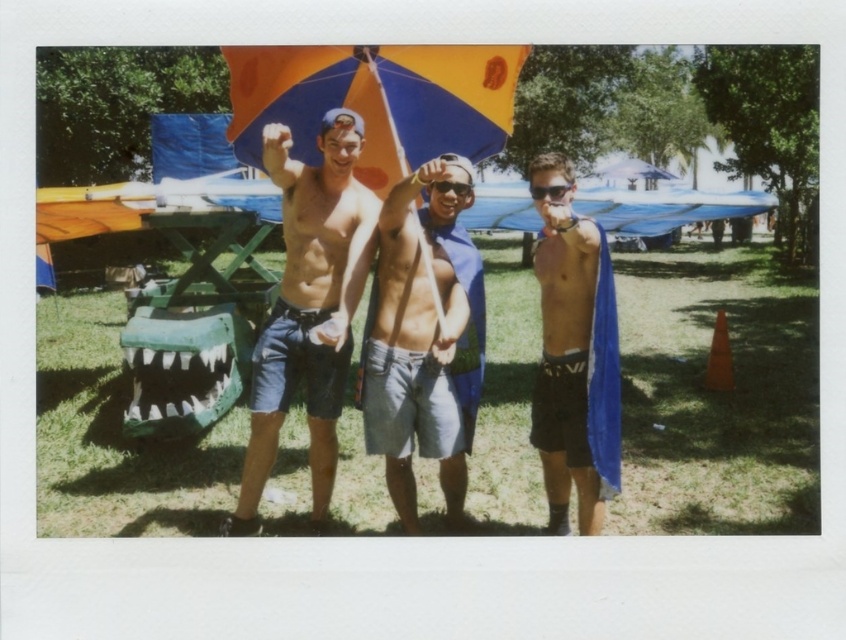
Which is behind, point (391, 356) or point (463, 182)?

Point (391, 356)

The width and height of the screenshot is (846, 640). Identify the location of gray cotton shorts at center. (423, 342).

Identify the location of gray cotton shorts at center. (423, 342).

Image resolution: width=846 pixels, height=640 pixels. I want to click on gray cotton shorts at center, so click(x=423, y=342).

Who is more distant from viewer, [283,45] or [585,406]?

The point [283,45] is behind.

This screenshot has width=846, height=640. I want to click on orange and blue umbrella at center, so click(x=377, y=100).

Consider the image. Who is taller, gray cotton shorts at center or black plastic goggles at center?

gray cotton shorts at center is taller.

Is gray cotton shorts at center to the left of black plastic goggles at center from the viewer's perspective?

Yes, gray cotton shorts at center is to the left of black plastic goggles at center.

What are the coordinates of `gray cotton shorts at center` in the screenshot? It's located at (423, 342).